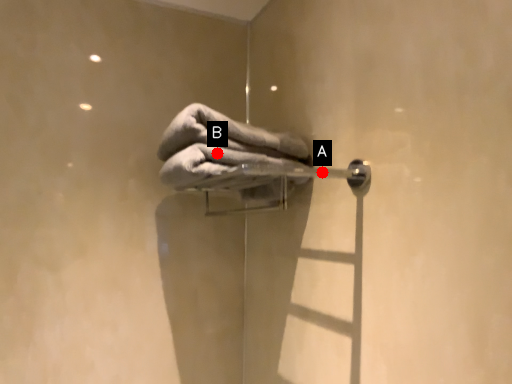
Question: Two points are circled on the image, labeled by A and B beside each circle. Which of the following is the closest to the observer?

Choices:
 (A) A is closer
 (B) B is closer

Answer: (B)